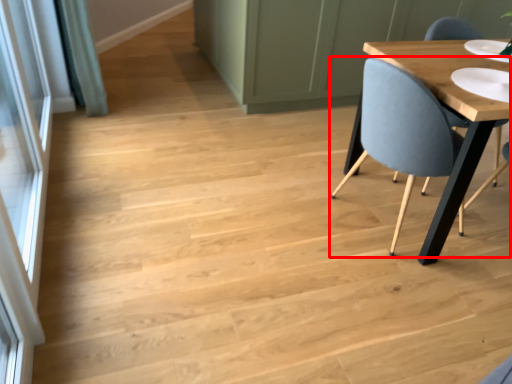
Question: From the image's perspective, what is the correct spatial relationship of chair (annotated by the red box) in relation to screen door?

Choices:
 (A) below
 (B) above

Answer: (B)